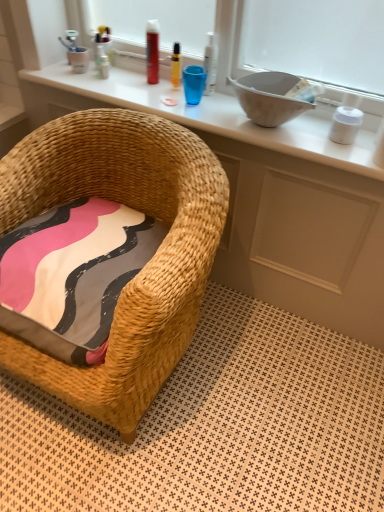
The width and height of the screenshot is (384, 512). I want to click on vacant space that is in between white plastic bottle at upper center, placed as the 5th toiletry when sorted from right to left, and gray matte bowl at upper right, so click(169, 96).